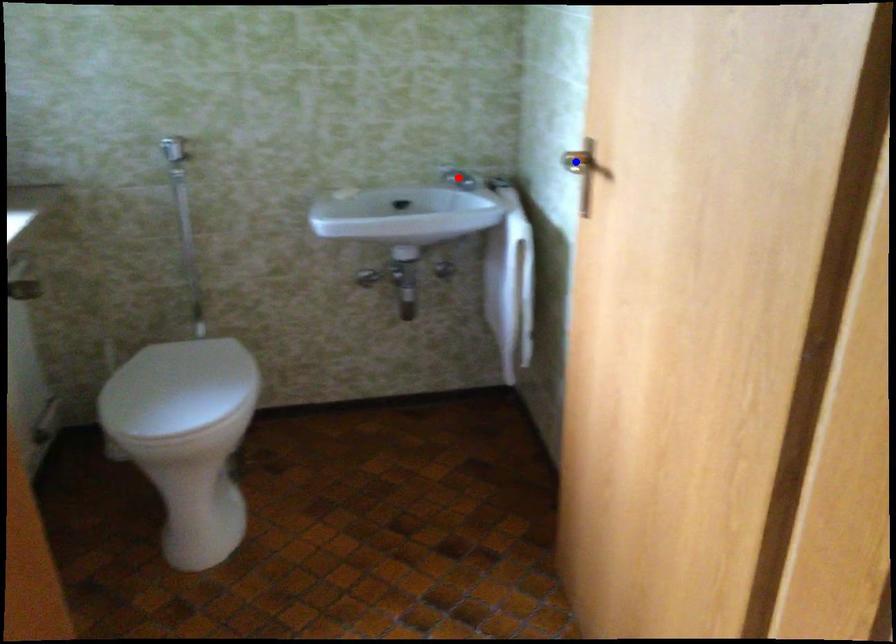
Question: Which of the two points in the image is closer to the camera?

Choices:
 (A) Blue point is closer.
 (B) Red point is closer.

Answer: (A)